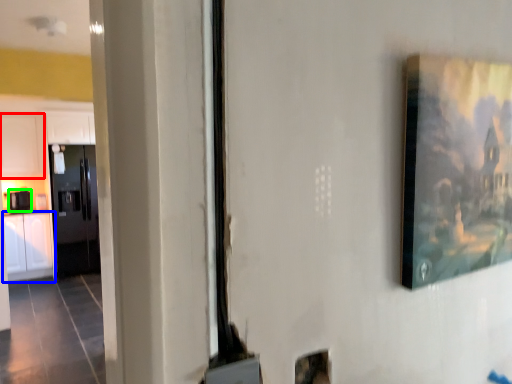
Question: Based on their relative distances, which object is farther from cabinetry (highlighted by a red box)? Choose from cabinetry (highlighted by a blue box) and appliance (highlighted by a green box).

Choices:
 (A) cabinetry
 (B) appliance

Answer: (A)